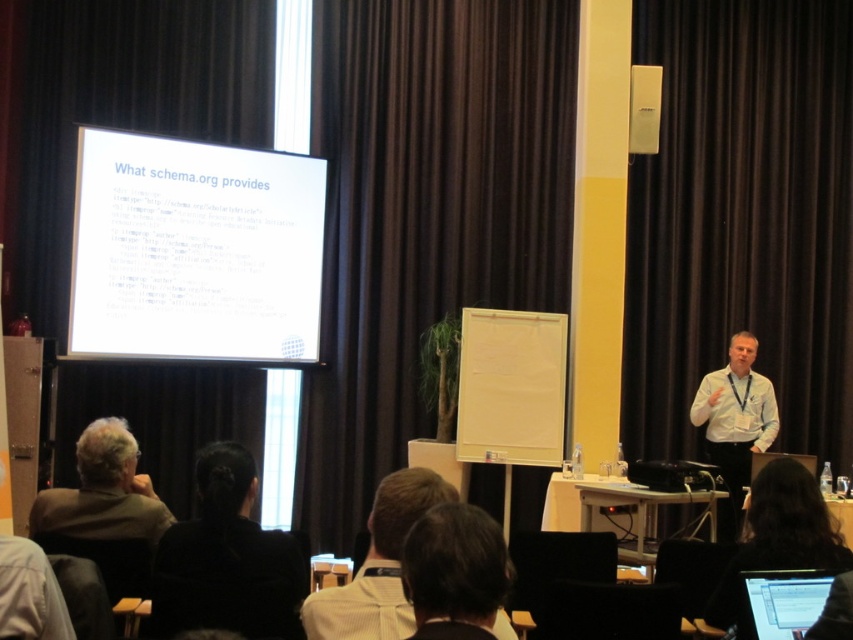
You are standing in the presentation room and want to move from the point at the bottom of the screen to the point near the top. Which direction should you move relative to the two points labeled as point (280, 204) and point (393, 625)?

To move from the point at the bottom of the screen to the point near the top, you should move towards point (393, 625) since it is positioned higher than point (280, 204).

Based on the photo, you are an event organizer who needs to decide if the brown fabric curtain at upper center can be moved to cover the black fabric hair at lower center. Based on their sizes, is this possible?

The brown fabric curtain at upper center has a larger width than the black fabric hair at lower center, so it can be moved to cover it since it is wider.

You are a person standing at the front of the room facing the projection screen. You want to move closer to the screen. Which point, point (x=132, y=355) or point (x=129, y=538), is closer to you?

Point (x=132, y=355) is further to the viewer than point (x=129, y=538), so the closer point to you is point (x=129, y=538).